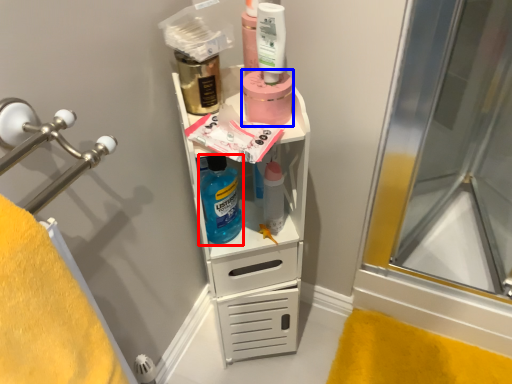
Question: Which point is closer to the camera, cleaning product (highlighted by a red box) or product (highlighted by a blue box)?

Choices:
 (A) cleaning product
 (B) product

Answer: (B)